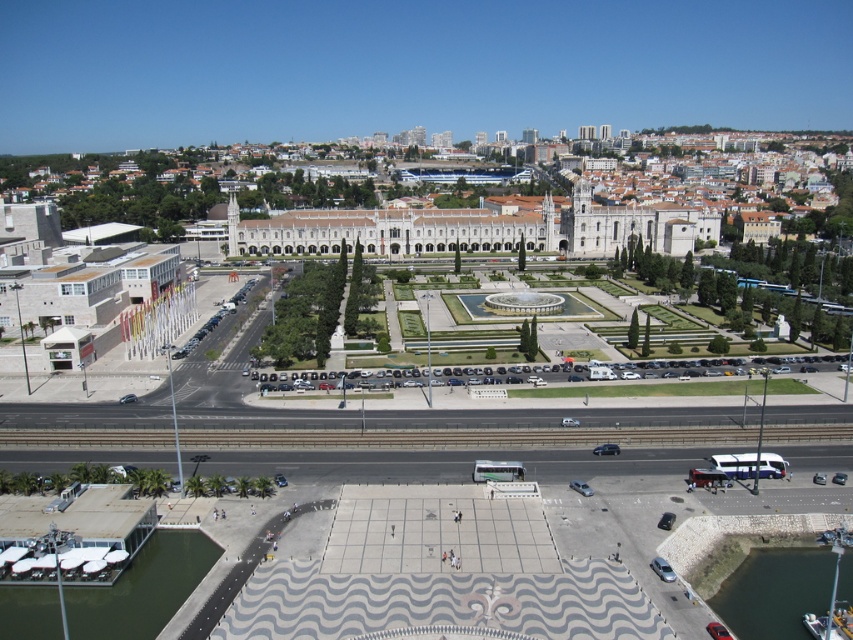
Question: Which object is farther from the camera taking this photo?

Choices:
 (A) white stone building at center
 (B) dark green water at lower right

Answer: (A)

Question: Does white stone building at center have a lesser width compared to greenish concrete dock at lower left?

Choices:
 (A) yes
 (B) no

Answer: (B)

Question: Is greenish concrete dock at lower left to the left of dark green water at lower right from the viewer's perspective?

Choices:
 (A) yes
 (B) no

Answer: (A)

Question: Is white stone building at center further to the viewer compared to greenish concrete dock at lower left?

Choices:
 (A) no
 (B) yes

Answer: (B)

Question: Which of the following is the closest to the observer?

Choices:
 (A) white stone building at center
 (B) dark green water at lower right
 (C) greenish concrete dock at lower left

Answer: (C)

Question: Which is farther from the dark green water at lower right?

Choices:
 (A) white stone building at center
 (B) greenish concrete dock at lower left

Answer: (A)